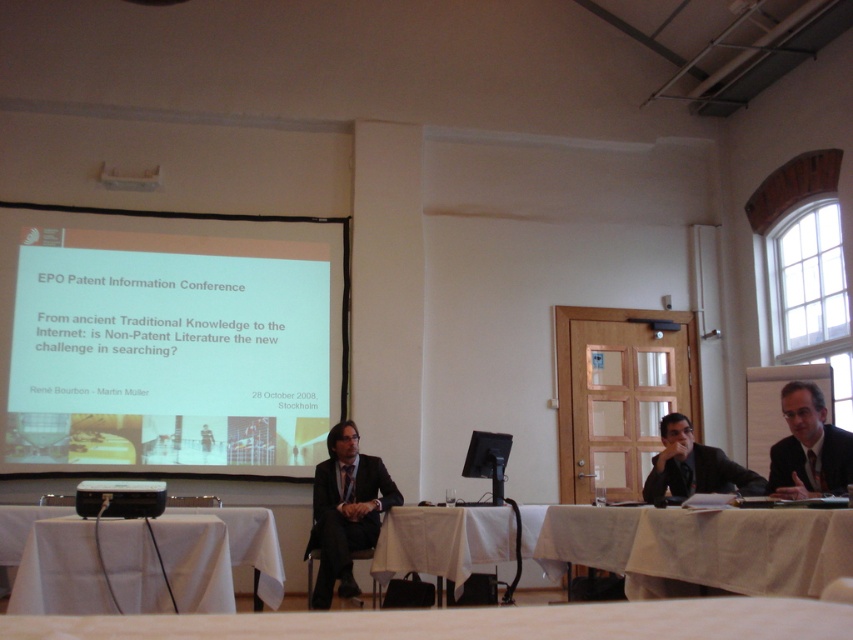
Question: Is white fabric table at center wider than black matte suit at right?

Choices:
 (A) yes
 (B) no

Answer: (A)

Question: Which point is farther to the camera?

Choices:
 (A) white fabric table at lower center
 (B) black plastic projector at lower left

Answer: (B)

Question: Observing the image, what is the correct spatial positioning of white fabric table at lower center in reference to black matte suit at right?

Choices:
 (A) below
 (B) above

Answer: (B)

Question: Among these points, which one is nearest to the camera?

Choices:
 (A) (282, 346)
 (B) (108, 493)
 (C) (807, 561)
 (D) (328, 552)

Answer: (C)

Question: Can you confirm if white fabric table at center is positioned to the left of matte black suit at center?

Choices:
 (A) no
 (B) yes

Answer: (A)

Question: Which of the following is the closest to the observer?

Choices:
 (A) white cloth at lower right
 (B) black plastic projector at lower left
 (C) white matte projector screen at upper left

Answer: (A)